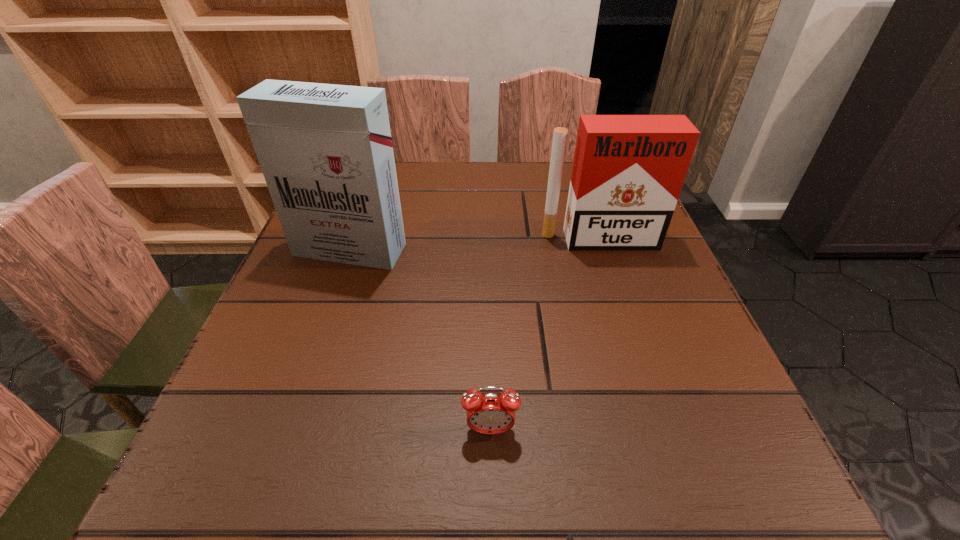
Where is `object that is at the right edge`? The width and height of the screenshot is (960, 540). object that is at the right edge is located at coordinates (628, 170).

The width and height of the screenshot is (960, 540). In the image, there is a desktop. What are the coordinates of `free space at the far edge` in the screenshot? It's located at coord(452,210).

You are a GUI agent. You are given a task and a screenshot of the screen. Output one action in this format:
    pyautogui.click(x=<x>, y=<y>)
    Task: Click on the vacant space at the near edge
    
    Given the screenshot: What is the action you would take?
    pyautogui.click(x=559, y=471)

Identify the location of free spot at the left edge of the desktop. (300, 354).

Where is `free space at the right edge of the desktop`? The height and width of the screenshot is (540, 960). free space at the right edge of the desktop is located at coordinates (646, 379).

Image resolution: width=960 pixels, height=540 pixels. In the image, there is a desktop. What are the coordinates of `vacant space at the near left corner` in the screenshot? It's located at point(267,490).

Find the location of a particular element. This screenshot has height=540, width=960. blank region between the left cigarette case and the shorter cigarette case is located at coordinates (474, 245).

Where is `free space between the nearest object and the second shortest object`? free space between the nearest object and the second shortest object is located at coordinates (544, 335).

The height and width of the screenshot is (540, 960). I want to click on vacant area between the second shortest object and the nearest object, so click(544, 335).

Where is `vacant area between the second tallest object and the alarm clock`? The image size is (960, 540). vacant area between the second tallest object and the alarm clock is located at coordinates (544, 335).